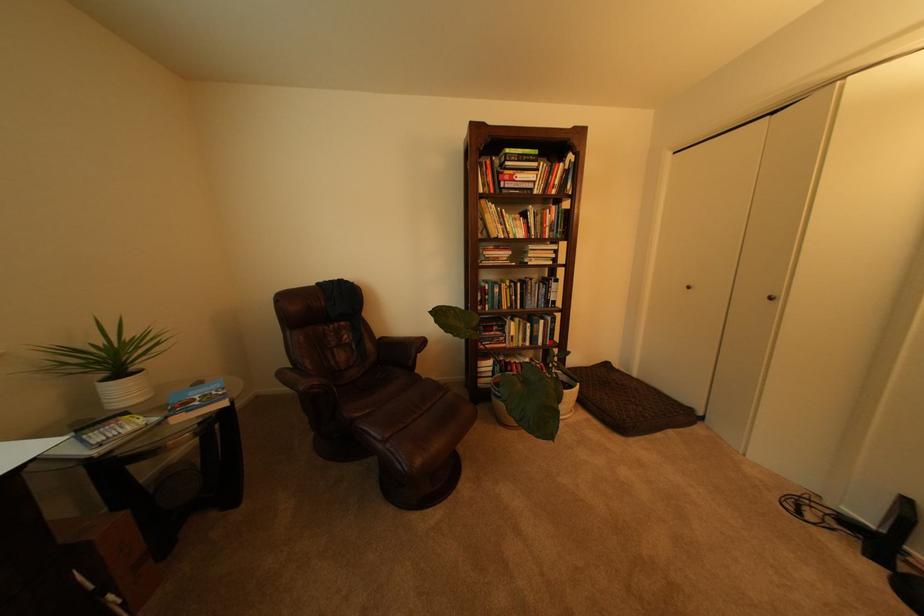
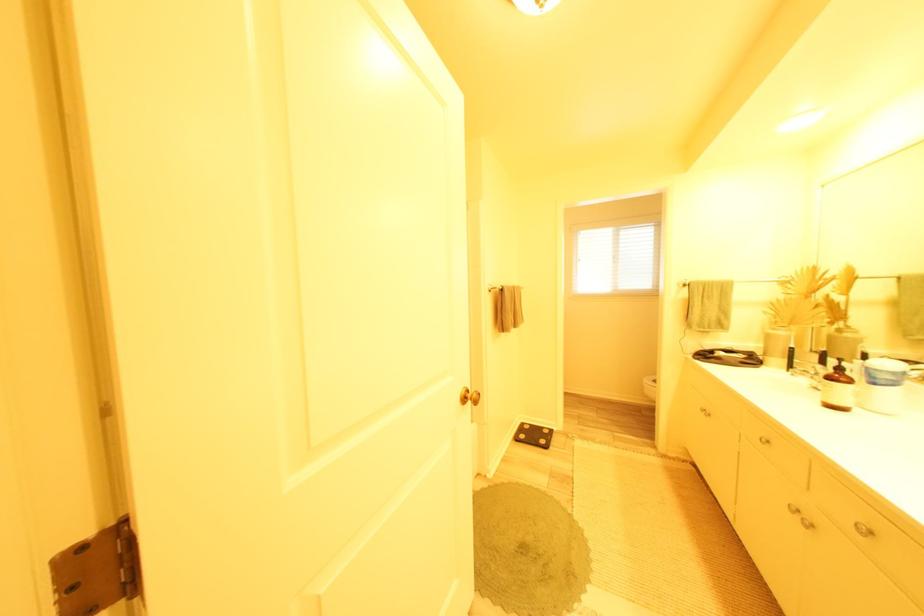
Question: I am providing you with two images of the same scene from different viewpoints. After the viewpoint changes to image2, which objects are now occluded?

Choices:
 (A) brown floor mat
 (B) faucet handle
 (C) black floor scale
 (D) blue suitcase

Answer: (A)